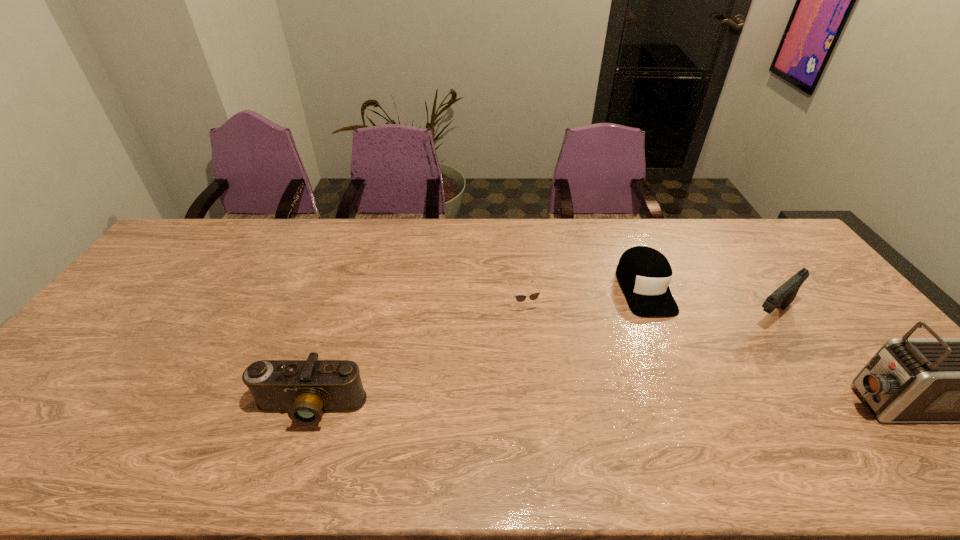
The width and height of the screenshot is (960, 540). Find the location of `camera`. camera is located at coordinates (305, 389).

Find the location of a particular element. This screenshot has height=540, width=960. cap is located at coordinates (644, 273).

At what (x,y) coordinates should I click in order to perform the action: click on the second shortest object. Please return your answer as a coordinate pair (x, y). Image resolution: width=960 pixels, height=540 pixels. Looking at the image, I should click on (644, 273).

This screenshot has height=540, width=960. I want to click on pistol, so click(782, 297).

Locate an element on the screen. This screenshot has width=960, height=540. sunglasses is located at coordinates (520, 298).

You are a GUI agent. You are given a task and a screenshot of the screen. Output one action in this format:
    pyautogui.click(x=<x>, y=<y>)
    Task: Click on the shortest object
    This screenshot has height=540, width=960.
    Given the screenshot: What is the action you would take?
    pyautogui.click(x=520, y=298)

Image resolution: width=960 pixels, height=540 pixels. What are the coordinates of `vacant space situated on the front-facing side of the fourth tallest object` in the screenshot? It's located at (663, 332).

In order to click on free space located 0.350m on the front-facing side of the fourth tallest object in this screenshot , I will do (x=707, y=429).

Locate an element on the screen. Image resolution: width=960 pixels, height=540 pixels. free location located 0.060m on the front-facing side of the fourth tallest object is located at coordinates (664, 334).

What are the coordinates of `vacant area situated 0.230m at the barrel of the pistol` in the screenshot? It's located at (708, 365).